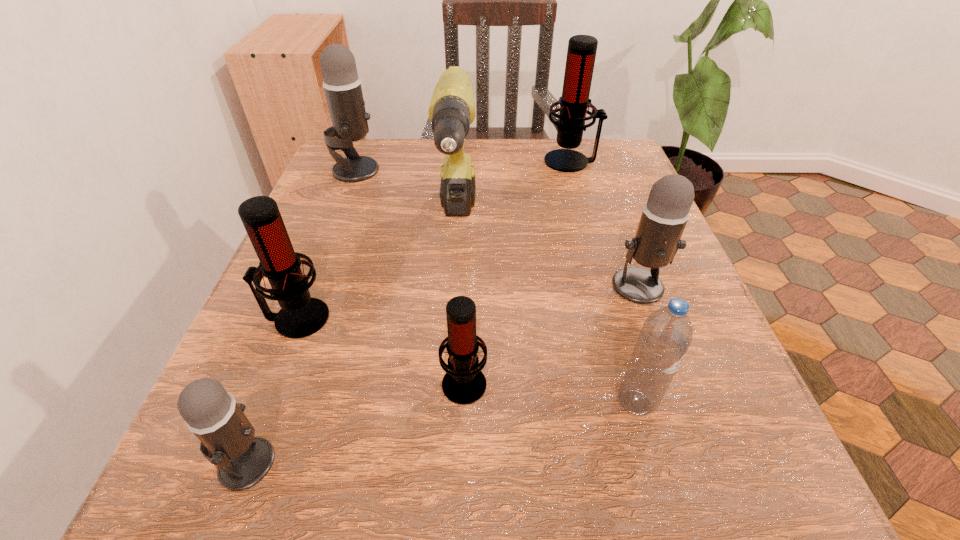
This screenshot has width=960, height=540. Identify the location of free region located 0.370m on the back of the nearest gray microphone. (329, 246).

At what (x,y) coordinates should I click in order to perform the action: click on drill at the far edge. Please return your answer as a coordinate pair (x, y). Image resolution: width=960 pixels, height=540 pixels. Looking at the image, I should click on (452, 109).

Locate an element on the screen. Image resolution: width=960 pixels, height=540 pixels. object that is at the near edge is located at coordinates (227, 438).

Where is `water bottle located in the right edge section of the desktop`? water bottle located in the right edge section of the desktop is located at coordinates (666, 335).

Locate an element on the screen. The height and width of the screenshot is (540, 960). object located at the far left corner is located at coordinates (342, 85).

The image size is (960, 540). Identify the location of object that is at the near left corner. point(227,438).

The height and width of the screenshot is (540, 960). In order to click on object positioned at the far right corner in this screenshot , I will do `click(581, 53)`.

Where is `vacant point at the far edge`? This screenshot has width=960, height=540. vacant point at the far edge is located at coordinates click(420, 155).

Image resolution: width=960 pixels, height=540 pixels. In order to click on free space at the near edge of the desktop in this screenshot , I will do `click(451, 457)`.

Locate an element on the screen. The height and width of the screenshot is (540, 960). vacant space at the right edge of the desktop is located at coordinates 714,360.